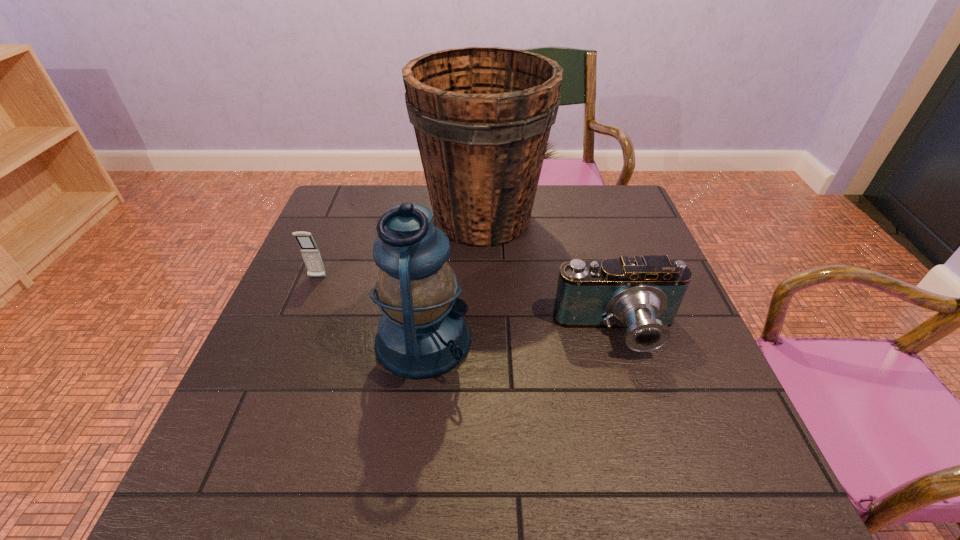
Find the location of a particular element. the farthest object is located at coordinates (482, 116).

Where is `bucket`? The image size is (960, 540). bucket is located at coordinates (482, 116).

Find the location of `the second tallest object`. the second tallest object is located at coordinates (422, 333).

Locate an element on the screen. This screenshot has height=540, width=960. camcorder is located at coordinates (643, 294).

Where is `the leftmost object`? the leftmost object is located at coordinates (310, 252).

The image size is (960, 540). What are the coordinates of `the second farthest object` in the screenshot? It's located at (310, 252).

This screenshot has width=960, height=540. Identify the location of free point located on the left of the tallest object. (389, 218).

The image size is (960, 540). I want to click on free space located on the face of the third shortest object, so 648,340.

I want to click on vacant space positioned on the front-facing side of the camcorder, so click(653, 452).

Identify the location of vacant area located 0.380m on the front-facing side of the cellular telephone. The width and height of the screenshot is (960, 540). (263, 410).